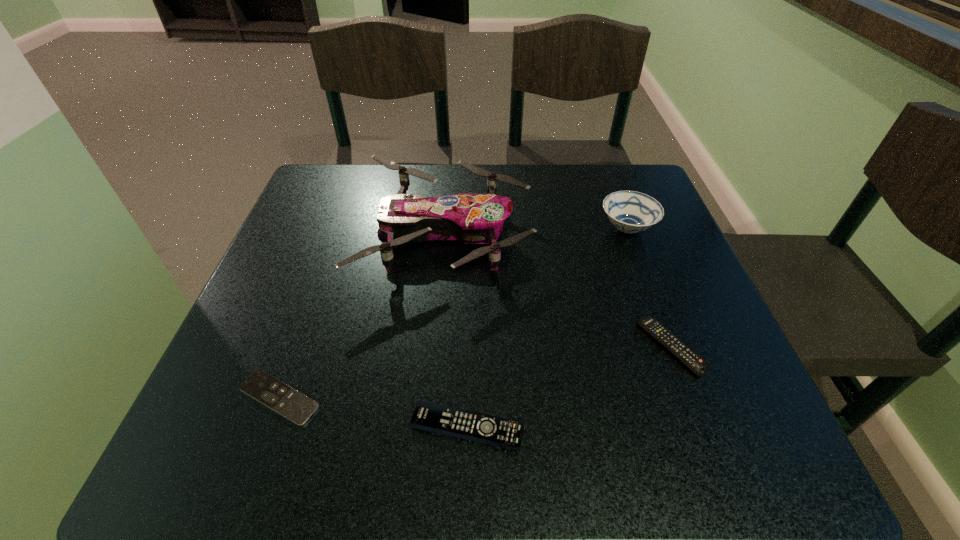
Locate an element on the screen. The width and height of the screenshot is (960, 540). free space located on the right of the leftmost remote control is located at coordinates (476, 398).

Identify the location of drone located at the far edge. (472, 218).

Locate an element on the screen. soup bowl that is at the far edge is located at coordinates (629, 211).

This screenshot has height=540, width=960. Identify the location of object that is positioned at the left edge. (276, 395).

Where is `soup bowl at the right edge`? soup bowl at the right edge is located at coordinates (629, 211).

Find the location of a particular element. This screenshot has width=960, height=540. remote control situated at the right edge is located at coordinates (668, 340).

You are a GUI agent. You are given a task and a screenshot of the screen. Output one action in this format:
    pyautogui.click(x=<x>, y=<y>)
    Task: Click on the object situated at the near left corner
    The width and height of the screenshot is (960, 540).
    Given the screenshot: What is the action you would take?
    pyautogui.click(x=276, y=395)

Find the location of `object present at the far right corner`. object present at the far right corner is located at coordinates (629, 211).

In the image, there is a desktop. Where is `vacant space at the far edge`? This screenshot has height=540, width=960. vacant space at the far edge is located at coordinates (465, 185).

Identify the location of blank space at the near edge of the desktop. (552, 461).